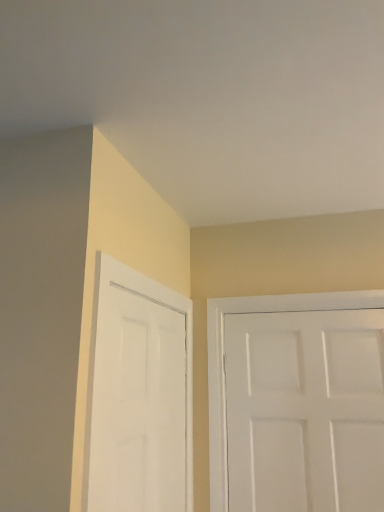
Question: Is white matte door at right, the first door from the right, taller or shorter than white matte door at left, placed as the 2th door when sorted from right to left?

Choices:
 (A) short
 (B) tall

Answer: (B)

Question: From a real-world perspective, is white matte door at right, which is counted as the second door, starting from the left, physically located above or below white matte door at left, the first door positioned from the left?

Choices:
 (A) above
 (B) below

Answer: (B)

Question: In terms of width, does white matte door at right, the first door from the right, look wider or thinner when compared to white matte door at left, the first door positioned from the left?

Choices:
 (A) thin
 (B) wide

Answer: (B)

Question: From the image's perspective, is white matte door at left, placed as the 2th door when sorted from right to left, positioned above or below white matte door at right, which is counted as the second door, starting from the left?

Choices:
 (A) below
 (B) above

Answer: (B)

Question: Is white matte door at left, placed as the 2th door when sorted from right to left, spatially inside white matte door at right, which is counted as the second door, starting from the left, or outside of it?

Choices:
 (A) inside
 (B) outside

Answer: (B)

Question: From a real-world perspective, relative to white matte door at right, which is counted as the second door, starting from the left, is white matte door at left, the first door positioned from the left, vertically above or below?

Choices:
 (A) above
 (B) below

Answer: (A)

Question: In terms of size, does white matte door at left, placed as the 2th door when sorted from right to left, appear bigger or smaller than white matte door at right, which is counted as the second door, starting from the left?

Choices:
 (A) big
 (B) small

Answer: (A)